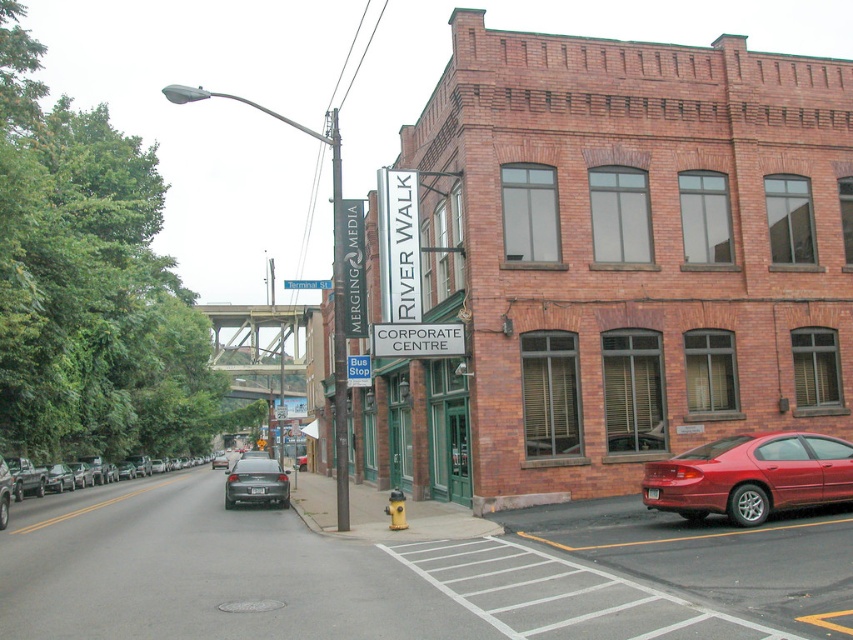
Question: Can you confirm if metallic gray signpost at center is positioned to the right of matte black sedan at center?

Choices:
 (A) yes
 (B) no

Answer: (B)

Question: Can you confirm if matte black sedan at center is positioned to the left of matte black sedan at left?

Choices:
 (A) no
 (B) yes

Answer: (A)

Question: Is matte black sedan at center above blue metallic street sign at upper center?

Choices:
 (A) yes
 (B) no

Answer: (B)

Question: Which of these objects is positioned closest to the blue metallic street sign at upper center?

Choices:
 (A) matte black sedan at left
 (B) metallic gray signpost at center
 (C) shiny red sedan at lower right

Answer: (B)

Question: Which point is closer to the camera?

Choices:
 (A) (323, 280)
 (B) (45, 484)
 (C) (234, 497)

Answer: (C)

Question: Which point is closer to the camera?

Choices:
 (A) (334, 202)
 (B) (62, 467)
 (C) (781, 484)

Answer: (C)